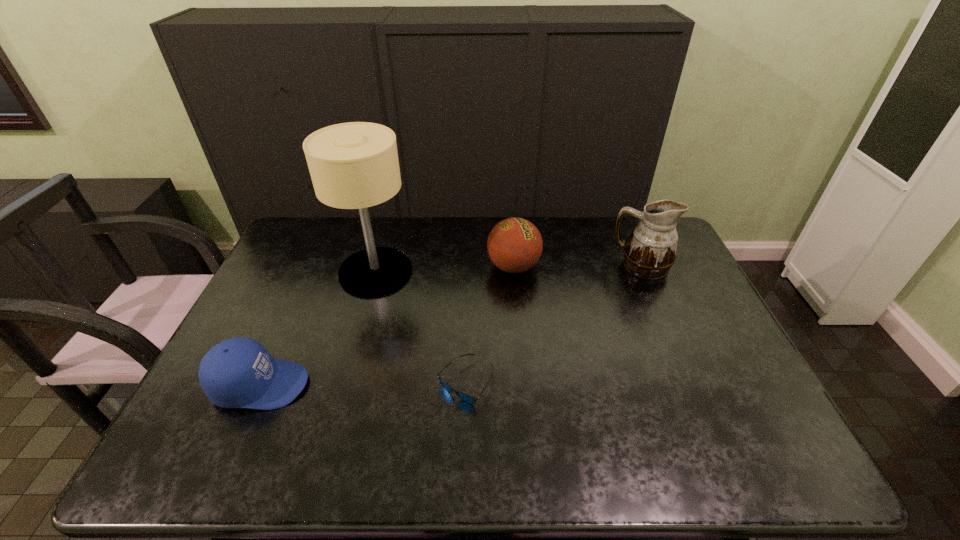
Where is `the tallest object`? the tallest object is located at coordinates (354, 165).

Locate an element on the screen. the rightmost object is located at coordinates (650, 251).

This screenshot has width=960, height=540. Identify the location of the fourth shortest object. coord(650,251).

At what (x,y) coordinates should I click in order to perform the action: click on the third shortest object. Please return your answer as a coordinate pair (x, y). The width and height of the screenshot is (960, 540). Looking at the image, I should click on pos(514,245).

You are a GUI agent. You are given a task and a screenshot of the screen. Output one action in this format:
    pyautogui.click(x=<x>, y=<y>)
    Task: Click on the cap
    The width and height of the screenshot is (960, 540).
    Given the screenshot: What is the action you would take?
    pyautogui.click(x=239, y=372)

Locate an element on the screen. This screenshot has height=540, width=960. the shortest object is located at coordinates (467, 398).

Identify the location of vacant space positioned 0.320m on the front of the tallest object. This screenshot has width=960, height=540. (345, 384).

This screenshot has width=960, height=540. Identify the location of vacant position located from the spout of the pitcher. (539, 266).

The image size is (960, 540). Identify the location of vacant area located 0.280m from the spout of the pitcher. (530, 266).

Where is `vacant position located from the spout of the pitcher`? The image size is (960, 540). vacant position located from the spout of the pitcher is located at coordinates [x=512, y=266].